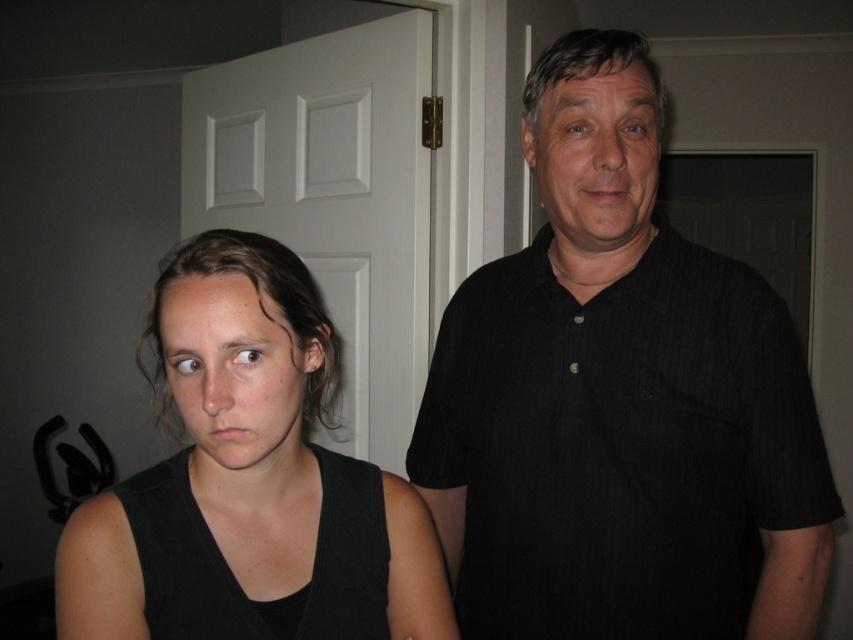
You are a delivery person trying to deliver a package to the address. The instructions say to leave the package between the matte black tank top at left and the person on the right. Can you fit the package there?

The distance between the matte black tank top at left and the person on the right is 23.88 inches, so yes, the package can be placed there as the space is sufficient.

You are trying to decide which shirt to wear for a casual day out. Both the black striped shirt at center and the smooth black shirt at center are options. If you want a shirt that is wider, which one should you choose?

The black striped shirt at center is wider than the smooth black shirt at center, so you should choose the black striped shirt at center for a wider option.

You are trying to decide which shirt to wear for a casual day out. You see both the black striped shirt at center and the smooth black shirt at center in the image. Which one is located lower on your body?

The black striped shirt at center is positioned under the smooth black shirt at center, so the black striped shirt at center is located lower on the body.